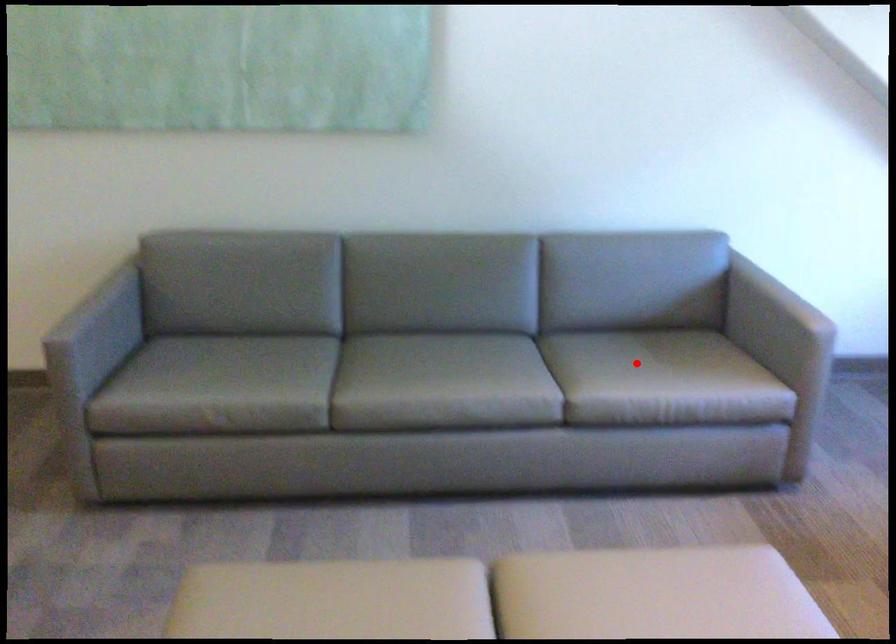
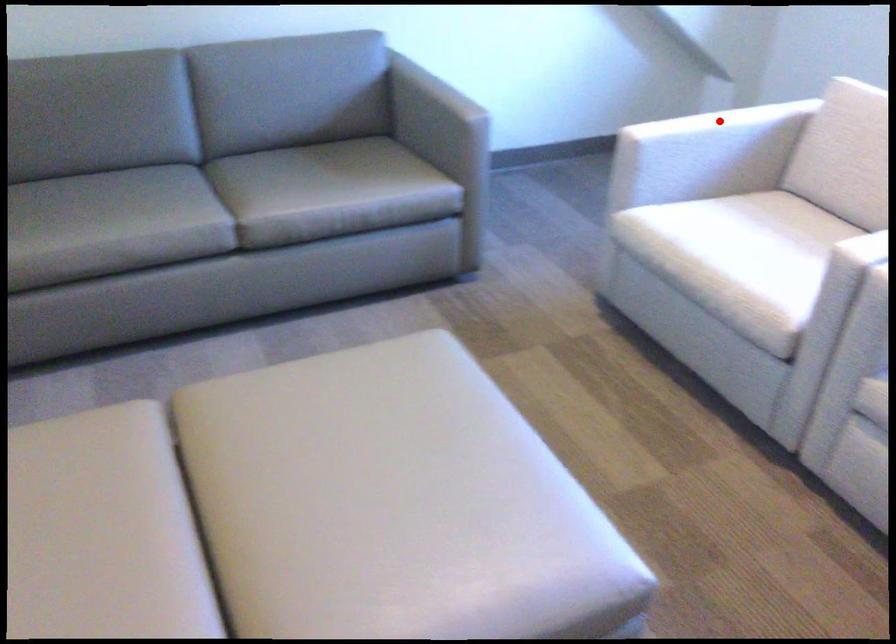
I am providing you with two images of the same scene from different viewpoints. A red point is marked on the first image and another point is marked on the second image. Is the red point in image1 aligned with the point shown in image2?

No